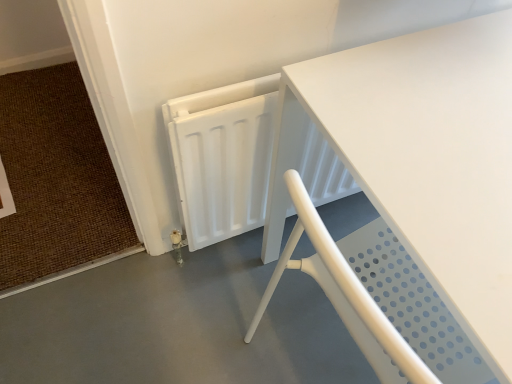
What is the approximate width of white perforated chair at lower right?

It is 21.33 inches.

Measure the distance between point (x=69, y=215) and camera.

Point (x=69, y=215) and camera are 4.48 feet apart.

The height and width of the screenshot is (384, 512). I want to click on white matte table at center, so click(411, 195).

Are white perforated chair at lower right and white matte table at center far apart?

No, white perforated chair at lower right is in close proximity to white matte table at center.

From their relative heights in the image, would you say white perforated chair at lower right is taller or shorter than white matte table at center?

Clearly, white perforated chair at lower right is shorter compared to white matte table at center.

Is point (89, 366) positioned in front of point (326, 261)?

No.

How different are the orientations of white perforated chair at lower right and white matte table at center in degrees?

They differ by 90 degrees in their facing directions.

From the image's perspective, is white matte table at center below brown woven mat at lower left?

Indeed, from the image's perspective, white matte table at center is shown beneath brown woven mat at lower left.

Is white matte table at center next to brown woven mat at lower left?

white matte table at center is not next to brown woven mat at lower left, and they're not touching.

Based on their positions, is white matte table at center located to the left or right of brown woven mat at lower left?

white matte table at center is to the right of brown woven mat at lower left.

Is the position of white matte table at center more distant than that of brown woven mat at lower left?

No.

Does brown woven mat at lower left appear on the right side of white matte table at center?

No, brown woven mat at lower left is not to the right of white matte table at center.

Which object is further away from the camera taking this photo, brown woven mat at lower left or white matte table at center?

brown woven mat at lower left is more distant.

In the scene shown: Which of these two, brown woven mat at lower left or white matte table at center, is wider?

brown woven mat at lower left is wider.

Where is `concrete below the brown woven mat at lower left (from the image's perspective)`? The height and width of the screenshot is (384, 512). concrete below the brown woven mat at lower left (from the image's perspective) is located at coordinates (178, 324).

Is brown woven mat at lower left bigger than white perforated chair at lower right?

Incorrect, brown woven mat at lower left is not larger than white perforated chair at lower right.

Is point (51, 79) closer to viewer compared to point (79, 297)?

No, (51, 79) is behind (79, 297).

Is brown woven mat at lower left facing away from white perforated chair at lower right?

brown woven mat at lower left does not have its back to white perforated chair at lower right.

Between white perforated chair at lower right and brown woven mat at lower left, which one appears on the left side from the viewer's perspective?

From the viewer's perspective, brown woven mat at lower left appears more on the left side.

Measure the distance from white perforated chair at lower right to brown woven mat at lower left.

white perforated chair at lower right and brown woven mat at lower left are 15.10 inches apart from each other.

I want to click on doormat behind the white perforated chair at lower right, so click(x=56, y=181).

Can you tell me how much white perforated chair at lower right and brown woven mat at lower left differ in facing direction?

They differ by 180 degrees in their facing directions.

Which object is wider, white matte table at center or white perforated chair at lower right?

With larger width is white perforated chair at lower right.

Which of these two, white matte table at center or white perforated chair at lower right, stands shorter?

With less height is white perforated chair at lower right.

You are a GUI agent. You are given a task and a screenshot of the screen. Output one action in this format:
    pyautogui.click(x=<x>, y=<y>)
    Task: Click on the table located above the white perforated chair at lower right (from the image's perspective)
    The image size is (512, 384).
    Given the screenshot: What is the action you would take?
    tap(411, 195)

Is white matte table at center not close to white perforated chair at lower right?

No, white matte table at center is in close proximity to white perforated chair at lower right.

Find the location of `concrete below the white matte table at center (from a real-world perspective)`. concrete below the white matte table at center (from a real-world perspective) is located at coordinates (178, 324).

The image size is (512, 384). In order to click on table on the right side of brown woven mat at lower left in this screenshot , I will do `click(411, 195)`.

When comparing their distances from white matte table at center, does brown woven mat at lower left or white perforated chair at lower right seem closer?

Among the two, white perforated chair at lower right is located nearer to white matte table at center.

Looking at this image, from the image, which object appears to be nearer to brown woven mat at lower left, white matte table at center or white perforated chair at lower right?

white perforated chair at lower right is closer to brown woven mat at lower left.

Looking at the image, which one is located further to white matte table at center, white perforated chair at lower right or brown woven mat at lower left?

brown woven mat at lower left is positioned further to the anchor white matte table at center.

Looking at the image, which one is located further to brown woven mat at lower left, white perforated chair at lower right or white matte table at center?

white matte table at center.

Considering their positions, is white matte table at center positioned further to white perforated chair at lower right than brown woven mat at lower left?

white matte table at center is further to white perforated chair at lower right.

Based on their spatial positions, is brown woven mat at lower left or white matte table at center closer to white perforated chair at lower right?

Among the two, brown woven mat at lower left is located nearer to white perforated chair at lower right.

You are a GUI agent. You are given a task and a screenshot of the screen. Output one action in this format:
    pyautogui.click(x=<x>, y=<y>)
    Task: Click on the concrete located between brown woven mat at lower left and white matte table at center in the left-right direction
    
    Given the screenshot: What is the action you would take?
    pyautogui.click(x=178, y=324)